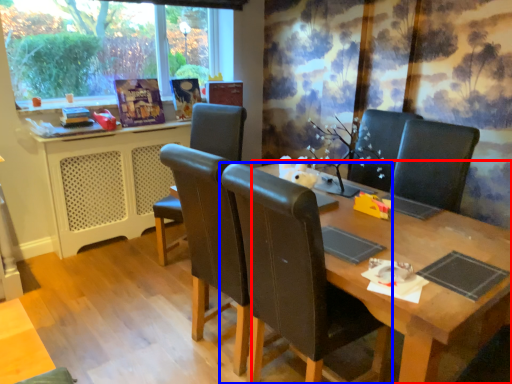
Question: Among these objects, which one is nearest to the camera, table (highlighted by a red box) or chair (highlighted by a blue box)?

Choices:
 (A) table
 (B) chair

Answer: (A)